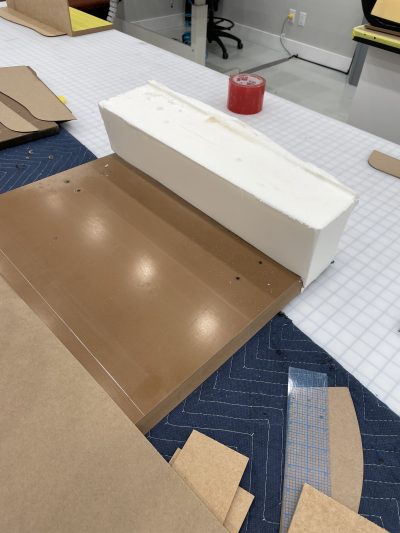
You are a GUI agent. You are given a task and a screenshot of the screen. Output one action in this format:
    pyautogui.click(x=<x>, y=<y>)
    Task: Click on the metal column
    
    Given the screenshot: What is the action you would take?
    pyautogui.click(x=197, y=32)